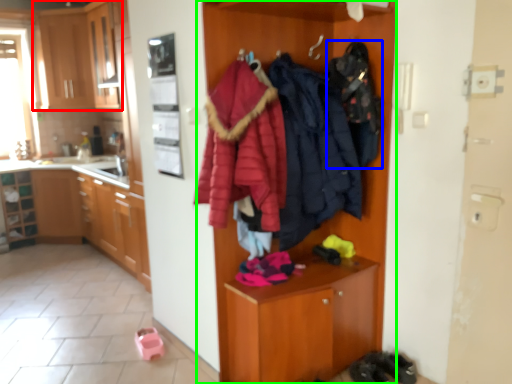
Question: Based on their relative distances, which object is nearer to cabinetry (highlighted by a red box)? Choose from clothing (highlighted by a blue box) and dresser (highlighted by a green box).

Choices:
 (A) clothing
 (B) dresser

Answer: (B)